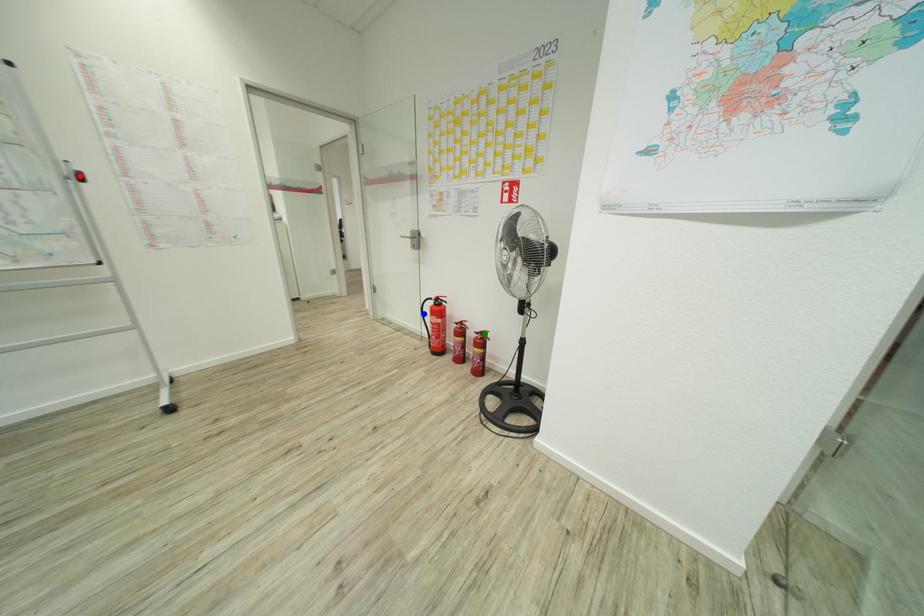
Order these from farthest to nearest:
A) red point
B) green point
C) blue point

blue point
green point
red point